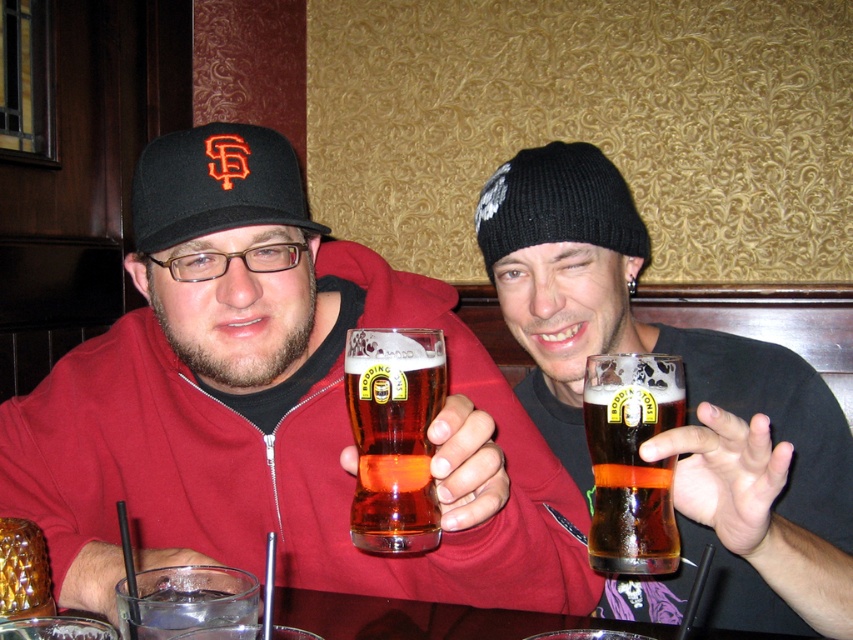
Who is lower down, brown glass beer at center or black fabric baseball cap at left?

Positioned lower is brown glass beer at center.

Find the location of a particular element. brown glass beer at center is located at coordinates (631, 460).

Image resolution: width=853 pixels, height=640 pixels. Identify the location of brown glass beer at center. (631, 460).

Between matte glass beer at center and brown glass beer at center, which one appears on the left side from the viewer's perspective?

matte glass beer at center

Who is lower down, matte glass beer at center or brown glass beer at center?

brown glass beer at center is lower down.

Locate an element on the screen. The image size is (853, 640). matte glass beer at center is located at coordinates (271, 406).

Is point (795, 442) less distant than point (204, 198)?

No, it is not.

Identify the location of matte black beanie at upper center. The height and width of the screenshot is (640, 853). (686, 404).